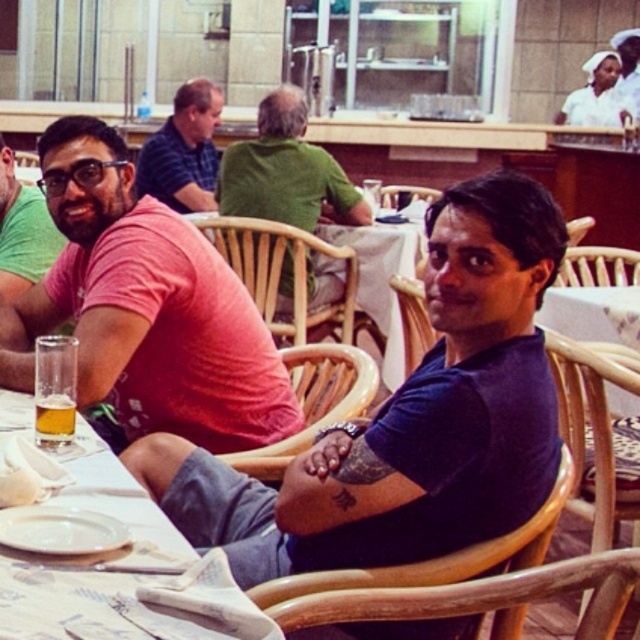
Question: Can you confirm if green matte shirt at center is positioned to the right of matte black shirt at left?

Choices:
 (A) no
 (B) yes

Answer: (B)

Question: Which of the following is the farthest from the observer?

Choices:
 (A) striped polo shirt at center
 (B) pink matte shirt at center
 (C) green matte shirt at center
 (D) smooth white shirt at center

Answer: (D)

Question: Among these points, which one is farthest from the camera?

Choices:
 (A) (38, 278)
 (B) (236, 205)
 (C) (198, 80)

Answer: (C)

Question: Is striped polo shirt at center positioned at the back of matte black shirt at left?

Choices:
 (A) yes
 (B) no

Answer: (A)

Question: Which point appears farthest from the camera in this image?

Choices:
 (A) (72, 115)
 (B) (68, 637)

Answer: (A)

Question: Does clear glass at lower left appear on the left side of matte black shirt at left?

Choices:
 (A) yes
 (B) no

Answer: (B)